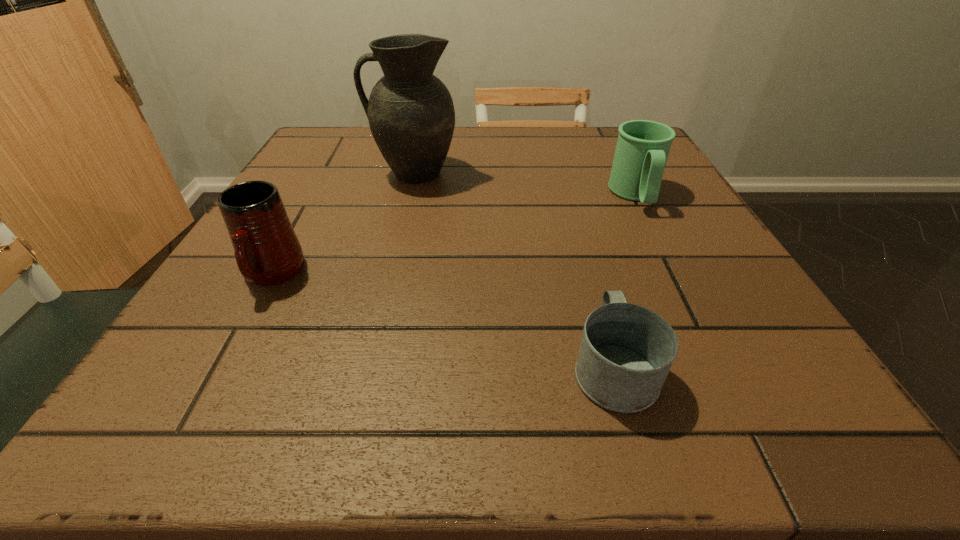
This screenshot has height=540, width=960. What are the coordinates of `the tallest object` in the screenshot? It's located at (411, 114).

In order to click on pitcher in this screenshot , I will do `click(411, 114)`.

Find the location of a particular element. The width and height of the screenshot is (960, 540). the leftmost mug is located at coordinates (267, 251).

Find the location of a particular element. This screenshot has height=540, width=960. the leftmost object is located at coordinates (267, 251).

At what (x,y) coordinates should I click in order to perform the action: click on the rightmost object. Please return your answer as a coordinate pair (x, y). Image resolution: width=960 pixels, height=540 pixels. Looking at the image, I should click on [643, 146].

Find the location of a particular element. The width and height of the screenshot is (960, 540). the farthest mug is located at coordinates (643, 146).

Identify the location of the nearest object. Image resolution: width=960 pixels, height=540 pixels. (626, 352).

Find the location of `the second mug from left to right`. the second mug from left to right is located at coordinates (x=626, y=352).

In order to click on vacant space situated 0.180m on the side of the third object from right to left with the handle in this screenshot , I will do `click(290, 173)`.

The height and width of the screenshot is (540, 960). What are the coordinates of `free region located on the side of the third farthest object with the handle` in the screenshot? It's located at coord(216,379).